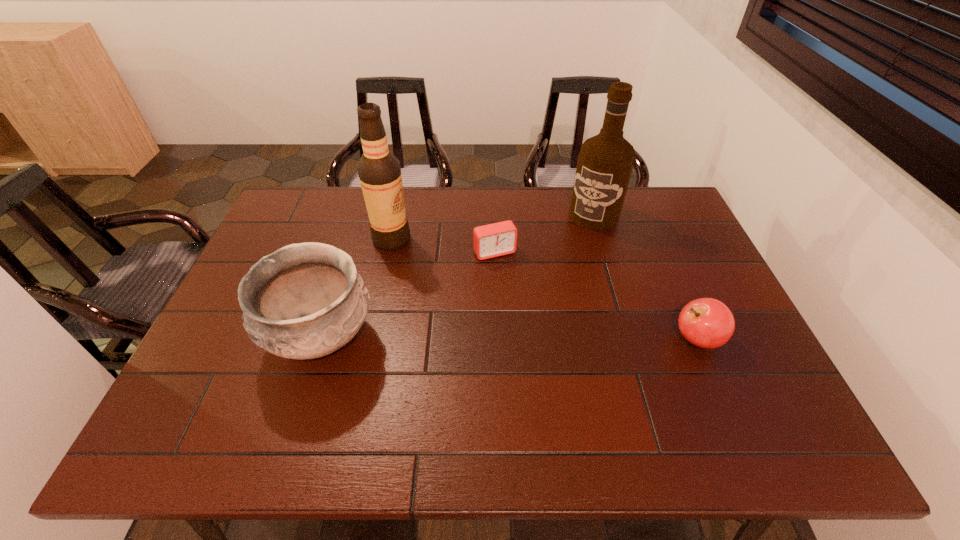
Identify the location of object at the right edge. This screenshot has width=960, height=540. (708, 323).

Where is `object present at the near left corner`? object present at the near left corner is located at coordinates (304, 301).

In the image, there is a desktop. Where is `free region at the far edge`? The width and height of the screenshot is (960, 540). free region at the far edge is located at coordinates (476, 187).

Identify the location of vacant space at the near edge of the desktop. (692, 401).

Find the location of a particular element. free region at the right edge is located at coordinates (695, 352).

What are the coordinates of `vacant region at the far left corner` in the screenshot? It's located at (332, 188).

Locate an element on the screen. The height and width of the screenshot is (540, 960). vacant space at the far right corner of the desktop is located at coordinates (670, 196).

In order to click on vacant space that is in between the shortest object and the rightmost object in this screenshot , I will do `click(596, 296)`.

Where is `vacant region between the pottery and the apple`? vacant region between the pottery and the apple is located at coordinates (509, 339).

Locate an element on the screen. vacant area that lies between the third shortest object and the fourth object from left to right is located at coordinates (458, 276).